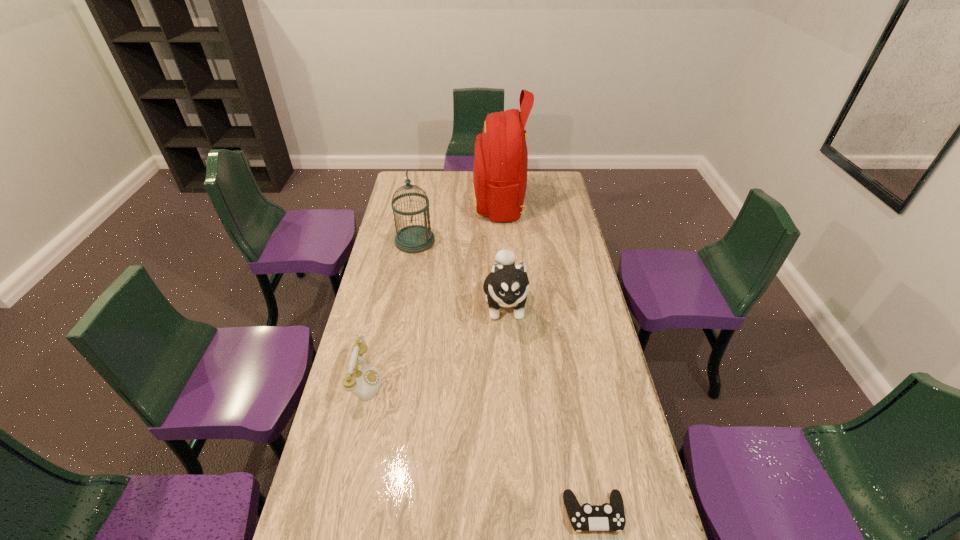
You are a GUI agent. You are given a task and a screenshot of the screen. Output one action in this format:
    pyautogui.click(x=<x>, y=<y>)
    Task: Click on the vacant space at the left edge
    
    Given the screenshot: What is the action you would take?
    pyautogui.click(x=414, y=223)

Find the location of `free space at the right edge`. free space at the right edge is located at coordinates (566, 324).

The width and height of the screenshot is (960, 540). What are the coordinates of `vacant region at the far left corner` in the screenshot? It's located at (419, 189).

This screenshot has width=960, height=540. In order to click on vacant space at the far right corner in this screenshot , I will do `click(540, 194)`.

The image size is (960, 540). Find the location of `free space between the shortest object and the farthest object`. free space between the shortest object and the farthest object is located at coordinates (546, 357).

I want to click on vacant space that is in between the third tallest object and the control, so click(550, 408).

I want to click on vacant area that lies between the second shortest object and the control, so click(479, 447).

Locate an element on the screen. The height and width of the screenshot is (540, 960). vacant space that is in between the puppy and the second shortest object is located at coordinates (435, 342).

The image size is (960, 540). What are the coordinates of `free area in between the second nearest object and the fourth nearest object` in the screenshot? It's located at (390, 311).

Image resolution: width=960 pixels, height=540 pixels. Find the location of `object that can be found as the closest to the nearest object`. object that can be found as the closest to the nearest object is located at coordinates (507, 285).